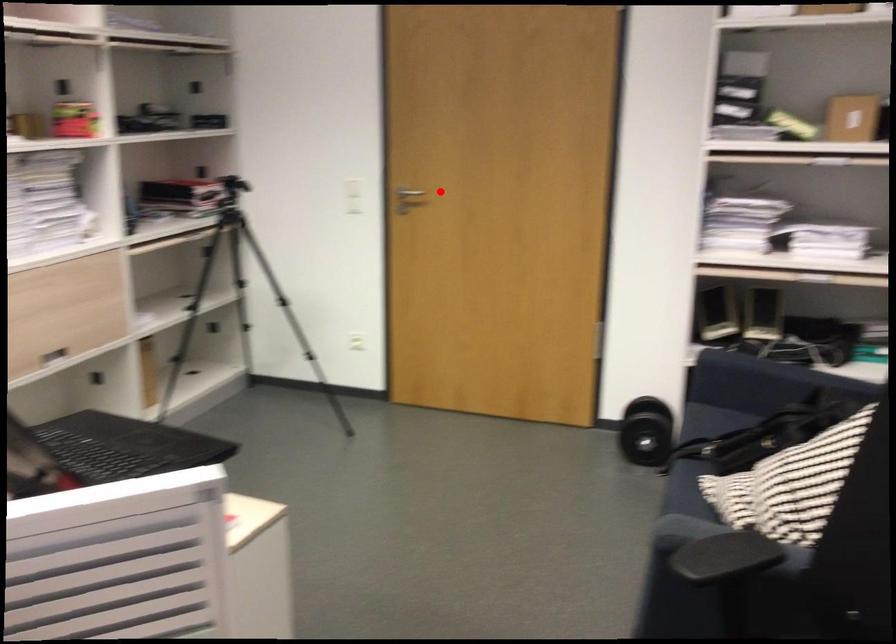
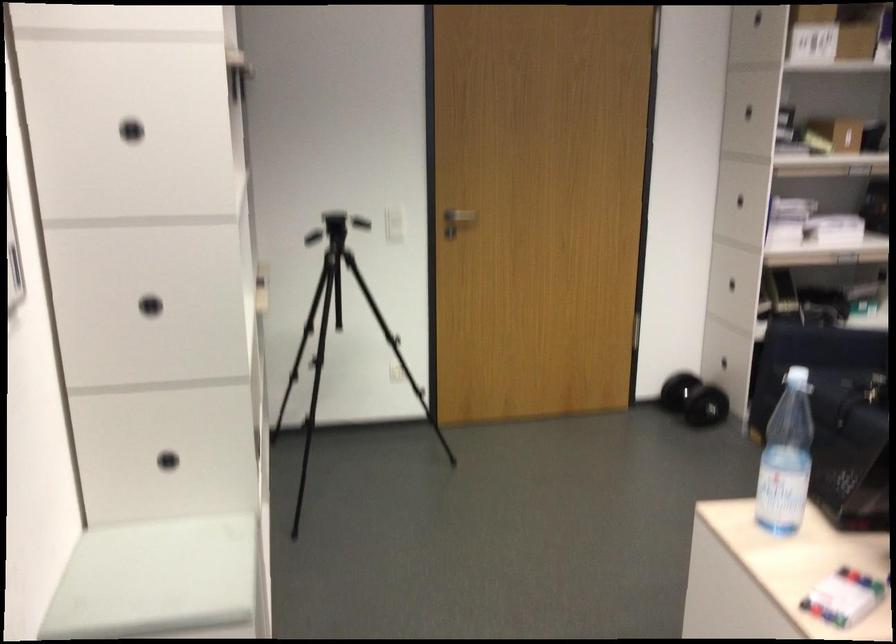
Where in the second image is the point corresponding to the highlighted location from the first image?

(460, 216)